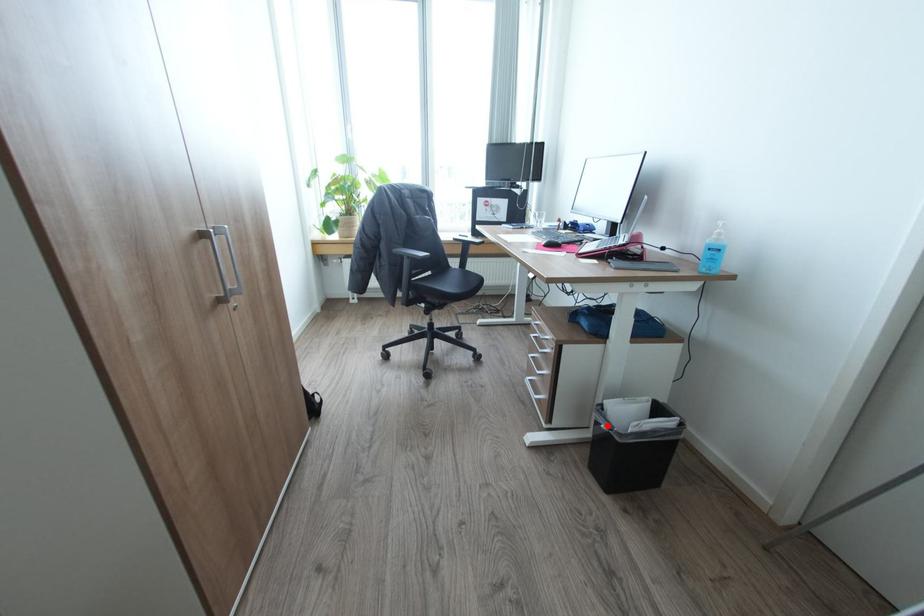
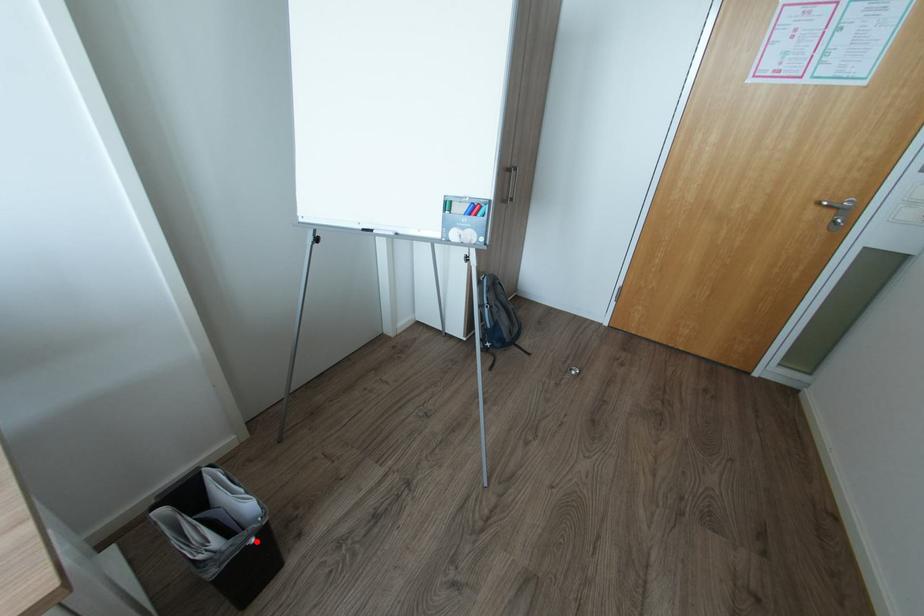
I am providing you with two images of the same scene from different viewpoints. A red point is marked on the first image and another point is marked on the second image. Do the highlighted points in image1 and image2 indicate the same real-world spot?

Yes